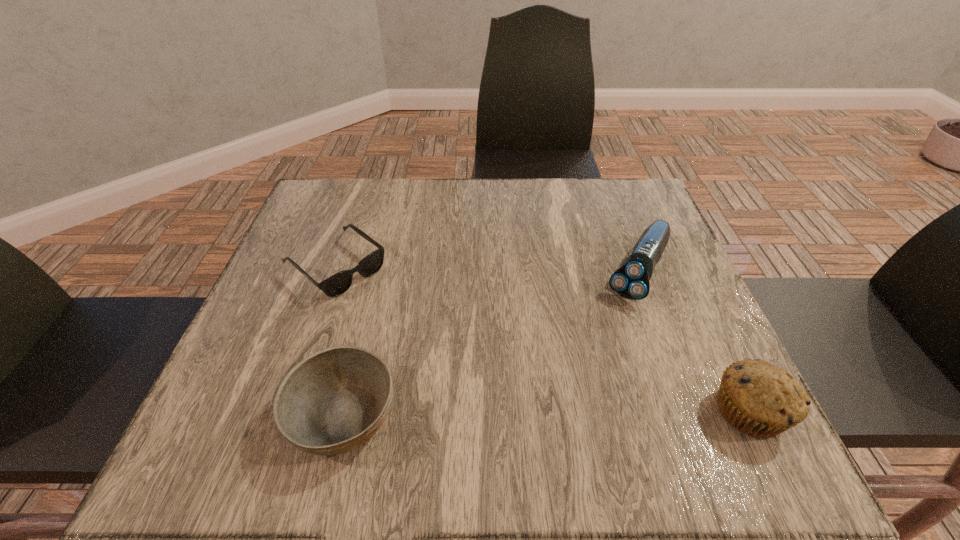
Where is `free spot on the desktop that is between the bowl and the muffin and is positioned at the front lenses of the shortest object`? free spot on the desktop that is between the bowl and the muffin and is positioned at the front lenses of the shortest object is located at coordinates (515, 414).

You are a GUI agent. You are given a task and a screenshot of the screen. Output one action in this format:
    pyautogui.click(x=<x>, y=<y>)
    Task: Click on the vacant spot on the desktop that is between the third tallest object and the muffin and is positioned on the head of the electric shaver
    The width and height of the screenshot is (960, 540).
    Given the screenshot: What is the action you would take?
    pyautogui.click(x=559, y=413)